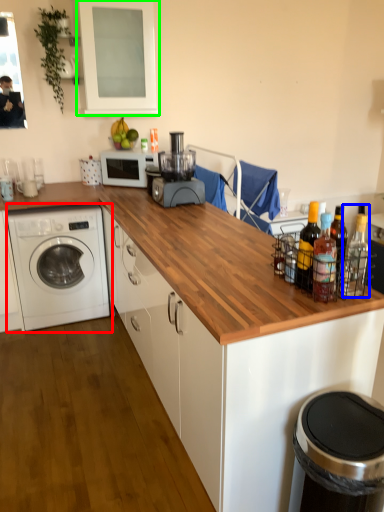
Question: Based on their relative distances, which object is nearer to washing machine (highlighted by a red box)? Choose from bottle (highlighted by a blue box) and window screen (highlighted by a green box).

Choices:
 (A) bottle
 (B) window screen

Answer: (B)